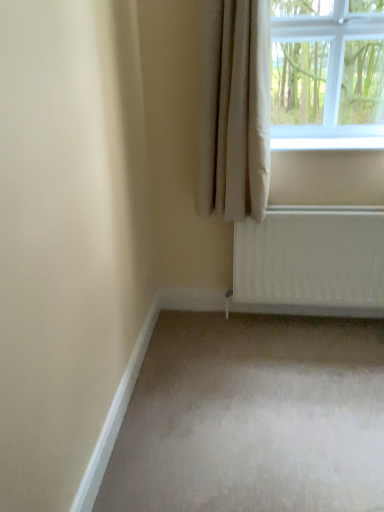
The width and height of the screenshot is (384, 512). What are the coordinates of `beige fabric curtain at upper right` in the screenshot? It's located at (234, 109).

Where is `white plastic window sill at upper right`? The width and height of the screenshot is (384, 512). white plastic window sill at upper right is located at coordinates (328, 143).

The image size is (384, 512). What are the coordinates of `white glass window at upper right` in the screenshot? It's located at (327, 74).

I want to click on curtain on the left of the white plastic window sill at upper right, so (x=234, y=109).

Is white plastic window sill at upper right in front of or behind beige fabric curtain at upper right in the image?

Visually, white plastic window sill at upper right is located behind beige fabric curtain at upper right.

Considering the sizes of objects white plastic window sill at upper right and beige fabric curtain at upper right in the image provided, who is shorter, white plastic window sill at upper right or beige fabric curtain at upper right?

Standing shorter between the two is white plastic window sill at upper right.

This screenshot has width=384, height=512. Find the location of `window that appears on the right of beige fabric curtain at upper right`. window that appears on the right of beige fabric curtain at upper right is located at coordinates (327, 74).

From a real-world perspective, between white glass window at upper right and beige fabric curtain at upper right, who is vertically lower?

beige fabric curtain at upper right is physically lower.

Is white glass window at upper right closer to camera compared to beige fabric curtain at upper right?

No, the depth of white glass window at upper right is greater than that of beige fabric curtain at upper right.

Considering the positions of objects white glass window at upper right and beige fabric curtain at upper right in the image provided, who is more to the right, white glass window at upper right or beige fabric curtain at upper right?

Positioned to the right is white glass window at upper right.

Considering the relative positions of white plastic window sill at upper right and white glass window at upper right in the image provided, is white plastic window sill at upper right to the right of white glass window at upper right from the viewer's perspective?

Correct, you'll find white plastic window sill at upper right to the right of white glass window at upper right.

Consider the image. From a real-world perspective, is white plastic window sill at upper right physically above white glass window at upper right?

Incorrect, from a real-world perspective, white plastic window sill at upper right is lower than white glass window at upper right.

Does white plastic window sill at upper right have a lesser width compared to white glass window at upper right?

Indeed, white plastic window sill at upper right has a lesser width compared to white glass window at upper right.

Is white plastic window sill at upper right aimed at white glass window at upper right?

No, white plastic window sill at upper right is not aimed at white glass window at upper right.

From a real-world perspective, is white glass window at upper right above or below white plastic window sill at upper right?

white glass window at upper right is above white plastic window sill at upper right.

I want to click on window sill behind the white glass window at upper right, so click(x=328, y=143).

Is white glass window at upper right far from white plastic window sill at upper right?

No, white glass window at upper right is in close proximity to white plastic window sill at upper right.

Which is closer to the camera, (360, 44) or (305, 141)?

Clearly, point (360, 44) is closer to the camera than point (305, 141).

The height and width of the screenshot is (512, 384). What are the coordinates of `curtain on the left of white glass window at upper right` in the screenshot? It's located at (234, 109).

From a real-world perspective, relative to white glass window at upper right, is beige fabric curtain at upper right vertically above or below?

From a real-world perspective, beige fabric curtain at upper right is physically below white glass window at upper right.

Looking at this image, how different are the orientations of beige fabric curtain at upper right and white glass window at upper right in degrees?

0.00115 degrees separate the facing orientations of beige fabric curtain at upper right and white glass window at upper right.

Does point (205, 133) appear closer or farther from the camera than point (373, 30)?

Point (205, 133) appears to be closer to the viewer than point (373, 30).

Which object is further away from the camera, beige fabric curtain at upper right or white plastic window sill at upper right?

white plastic window sill at upper right is more distant.

Identify the location of window sill behind the beige fabric curtain at upper right. (328, 143).

Is beige fabric curtain at upper right placed right next to white plastic window sill at upper right?

No, beige fabric curtain at upper right is not next to white plastic window sill at upper right.

Consider the image. Which of these two, beige fabric curtain at upper right or white plastic window sill at upper right, is thinner?

beige fabric curtain at upper right.

Find the location of a particular element. This screenshot has width=384, height=512. window sill located underneath the beige fabric curtain at upper right (from a real-world perspective) is located at coordinates (328, 143).

The image size is (384, 512). Find the location of `window behind the beige fabric curtain at upper right`. window behind the beige fabric curtain at upper right is located at coordinates (327, 74).

In the scene shown: From the image, which object appears to be nearer to white plastic window sill at upper right, white glass window at upper right or beige fabric curtain at upper right?

The object closer to white plastic window sill at upper right is white glass window at upper right.

Considering their positions, is white plastic window sill at upper right positioned further to beige fabric curtain at upper right than white glass window at upper right?

white glass window at upper right is further to beige fabric curtain at upper right.

When comparing their distances from white glass window at upper right, does beige fabric curtain at upper right or white plastic window sill at upper right seem further?

Among the two, beige fabric curtain at upper right is located further to white glass window at upper right.

From the image, which object appears to be nearer to white plastic window sill at upper right, beige fabric curtain at upper right or white glass window at upper right?

white glass window at upper right lies closer to white plastic window sill at upper right than the other object.

Based on their spatial positions, is white plastic window sill at upper right or beige fabric curtain at upper right further from white glass window at upper right?

beige fabric curtain at upper right is positioned further to the anchor white glass window at upper right.

Looking at the image, which one is located further to beige fabric curtain at upper right, white glass window at upper right or white plastic window sill at upper right?

white glass window at upper right is further to beige fabric curtain at upper right.

Locate an element on the screen. This screenshot has height=512, width=384. window situated between beige fabric curtain at upper right and white plastic window sill at upper right from left to right is located at coordinates (327, 74).